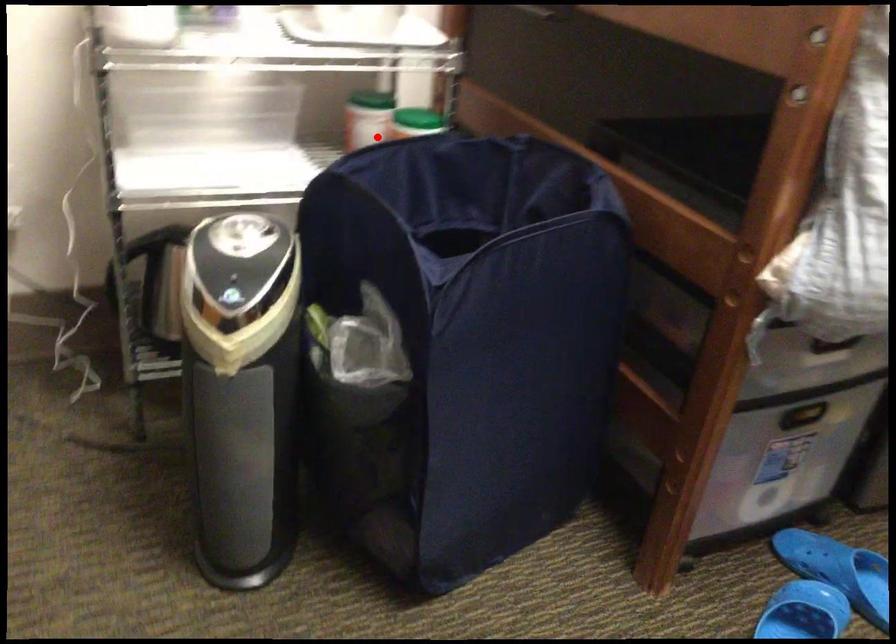
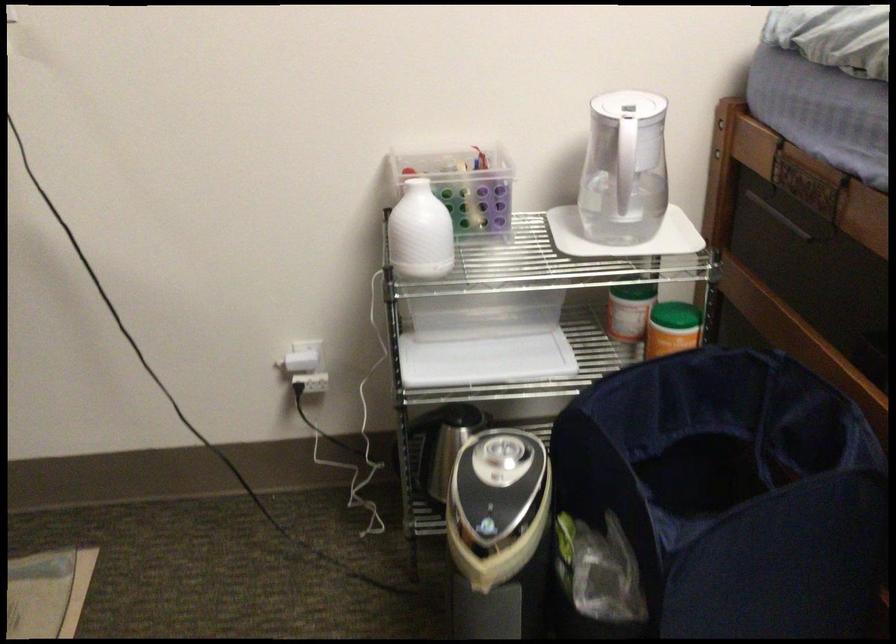
Find the pixel in the second image that matches the highlighted location in the first image.

(635, 325)